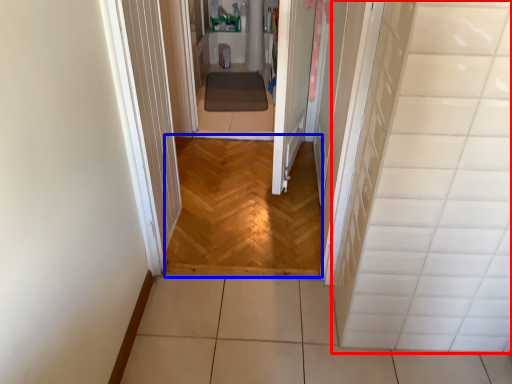
Question: Which point is closer to the camera, tile (highlighted by a red box) or corridor (highlighted by a blue box)?

Choices:
 (A) tile
 (B) corridor

Answer: (A)